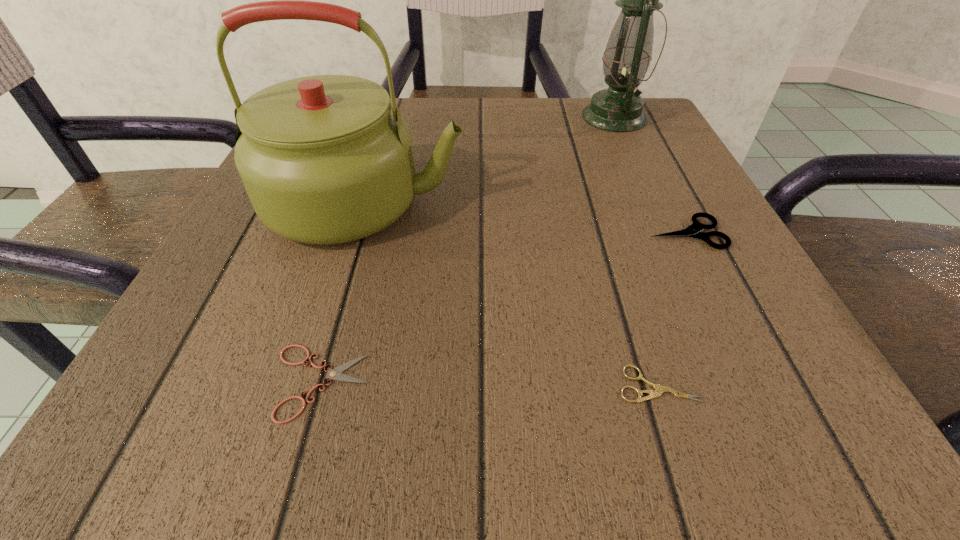
This screenshot has height=540, width=960. I want to click on free spot located on the right of the leftmost shears, so click(726, 382).

In order to click on object present at the far edge in this screenshot , I will do `click(628, 53)`.

Find the location of `kettle that is at the left edge`. kettle that is at the left edge is located at coordinates (324, 159).

Find the location of a particular element. Image resolution: width=960 pixels, height=540 pixels. shears at the left edge is located at coordinates (336, 374).

Find the location of `oil lamp situated at the right edge`. oil lamp situated at the right edge is located at coordinates (628, 53).

The width and height of the screenshot is (960, 540). What are the coordinates of `object present at the near left corner` in the screenshot? It's located at (336, 374).

Find the location of a particular element. The height and width of the screenshot is (540, 960). object present at the far right corner is located at coordinates (628, 53).

Where is `object positioned at the near right corner`? This screenshot has height=540, width=960. object positioned at the near right corner is located at coordinates (659, 389).

Identify the location of free space at the far edge of the desktop. The width and height of the screenshot is (960, 540). (479, 102).

Where is `vacant space at the near edge`? vacant space at the near edge is located at coordinates (290, 433).